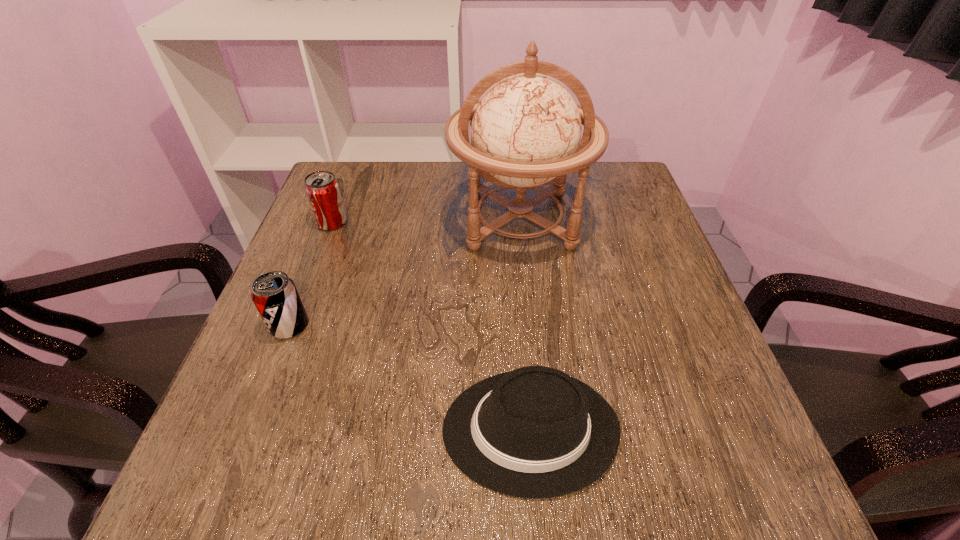
Identify the location of vacant space located 0.280m on the front-facing side of the nearest object. (272, 429).

Locate an element on the screen. The height and width of the screenshot is (540, 960). object positioned at the far edge is located at coordinates (525, 131).

Where is `object located at the near edge`? This screenshot has width=960, height=540. object located at the near edge is located at coordinates (535, 432).

Identify the location of object at the right edge. (525, 131).

This screenshot has height=540, width=960. What are the coordinates of `object that is positioned at the far right corner` in the screenshot? It's located at (525, 131).

Where is `blank area at the far edge`? blank area at the far edge is located at coordinates (397, 161).

Locate an element on the screen. Image resolution: width=960 pixels, height=540 pixels. vacant space at the near edge is located at coordinates (332, 466).

Find the location of a particular element. vacant space at the right edge of the desktop is located at coordinates (674, 323).

Locate an element on the screen. free space at the far left corner of the desktop is located at coordinates (349, 171).

The height and width of the screenshot is (540, 960). I want to click on free region at the near left corner, so click(275, 476).